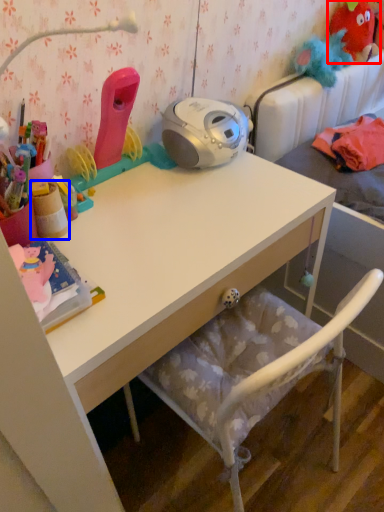
Question: Which of the following is the farthest to the observer, toy (highlighted by a red box) or stationery (highlighted by a blue box)?

Choices:
 (A) toy
 (B) stationery

Answer: (A)